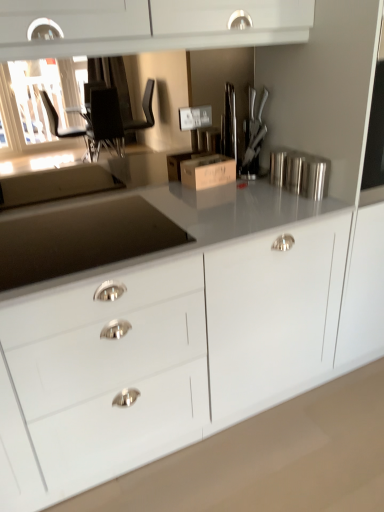
Image resolution: width=384 pixels, height=512 pixels. Describe the element at coordinates (300, 173) in the screenshot. I see `silver metallic canister at upper right` at that location.

In order to click on silver metallic canister at upper right in this screenshot , I will do `click(300, 173)`.

This screenshot has height=512, width=384. Identify the location of brown cardboard box at center. (207, 170).

Describe the element at coordinates (207, 170) in the screenshot. This screenshot has height=512, width=384. I see `brown cardboard box at center` at that location.

The width and height of the screenshot is (384, 512). I want to click on silver metallic canister at upper right, so click(x=300, y=173).

Can you confirm if silver metallic canister at upper right is positioned to the right of brown cardboard box at center?

Indeed, silver metallic canister at upper right is positioned on the right side of brown cardboard box at center.

Is silver metallic canister at upper right in front of brown cardboard box at center?

Yes, it is.

Is point (320, 192) farther from camera compared to point (191, 172)?

No, it is in front of (191, 172).

Looking at this image, from the image's perspective, is silver metallic canister at upper right over brown cardboard box at center?

No, from the image's perspective, silver metallic canister at upper right is not on top of brown cardboard box at center.

From a real-world perspective, is silver metallic canister at upper right on top of brown cardboard box at center?

Yes.

Which of these two, silver metallic canister at upper right or brown cardboard box at center, is thinner?

silver metallic canister at upper right is thinner.

Can you confirm if silver metallic canister at upper right is shorter than brown cardboard box at center?

In fact, silver metallic canister at upper right may be taller than brown cardboard box at center.

Considering the sizes of objects silver metallic canister at upper right and brown cardboard box at center in the image provided, who is bigger, silver metallic canister at upper right or brown cardboard box at center?

Bigger between the two is brown cardboard box at center.

Would you say silver metallic canister at upper right contains brown cardboard box at center?

Definitely not — brown cardboard box at center is not inside silver metallic canister at upper right.

Would you say silver metallic canister at upper right is a long distance from brown cardboard box at center?

No.

Is silver metallic canister at upper right oriented towards brown cardboard box at center?

No, silver metallic canister at upper right is not facing towards brown cardboard box at center.

Image resolution: width=384 pixels, height=512 pixels. Identify the location of appliance that appears in front of the brown cardboard box at center. (300, 173).

Can you confirm if brown cardboard box at center is positioned to the right of silver metallic canister at upper right?

Incorrect, brown cardboard box at center is not on the right side of silver metallic canister at upper right.

Between brown cardboard box at center and silver metallic canister at upper right, which one is positioned behind?

brown cardboard box at center is further from the camera.

Which is less distant, [233,170] or [315,170]?

Clearly, point [233,170] is more distant from the camera than point [315,170].

From the image's perspective, is brown cardboard box at center positioned above or below silver metallic canister at upper right?

Based on their image positions, brown cardboard box at center is located above silver metallic canister at upper right.

From a real-world perspective, is brown cardboard box at center beneath silver metallic canister at upper right?

Yes, from a real-world perspective, brown cardboard box at center is beneath silver metallic canister at upper right.

Is brown cardboard box at center wider or thinner than silver metallic canister at upper right?

Considering their sizes, brown cardboard box at center looks broader than silver metallic canister at upper right.

From their relative heights in the image, would you say brown cardboard box at center is taller or shorter than silver metallic canister at upper right?

Clearly, brown cardboard box at center is shorter compared to silver metallic canister at upper right.

Considering the relative sizes of brown cardboard box at center and silver metallic canister at upper right in the image provided, is brown cardboard box at center bigger than silver metallic canister at upper right?

Indeed, brown cardboard box at center has a larger size compared to silver metallic canister at upper right.

From the picture: Would you say brown cardboard box at center is outside silver metallic canister at upper right?

brown cardboard box at center lies outside silver metallic canister at upper right's area.

Would you say brown cardboard box at center is a long distance from silver metallic canister at upper right?

They are positioned close to each other.

Is brown cardboard box at center turned away from silver metallic canister at upper right?

No, brown cardboard box at center's orientation is not away from silver metallic canister at upper right.

This screenshot has width=384, height=512. I want to click on cardboard box on the left of silver metallic canister at upper right, so click(x=207, y=170).

Locate an element on the screen. Image resolution: width=384 pixels, height=512 pixels. cardboard box behind the silver metallic canister at upper right is located at coordinates coord(207,170).

What are the coordinates of `appliance located above the brown cardboard box at center (from a real-world perspective)` in the screenshot? It's located at (300, 173).